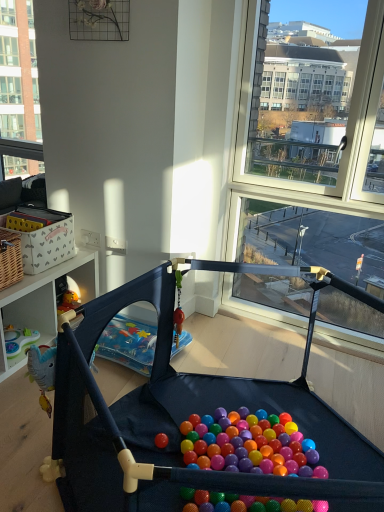
Question: Is matte black playpen at center facing away from clear glass window at upper left?

Choices:
 (A) no
 (B) yes

Answer: (A)

Question: From the image's perspective, would you say matte black playpen at center is positioned over clear glass window at upper left?

Choices:
 (A) no
 (B) yes

Answer: (A)

Question: From a real-world perspective, is matte black playpen at center below clear glass window at upper left?

Choices:
 (A) no
 (B) yes

Answer: (B)

Question: Is matte black playpen at center smaller than clear glass window at upper left?

Choices:
 (A) no
 (B) yes

Answer: (A)

Question: From a real-world perspective, is matte black playpen at center positioned over clear glass window at upper left based on gravity?

Choices:
 (A) yes
 (B) no

Answer: (B)

Question: Is the position of matte black playpen at center more distant than that of clear glass window at upper left?

Choices:
 (A) no
 (B) yes

Answer: (A)

Question: Does clear glass window at upper left lie behind matte black playpen at center?

Choices:
 (A) no
 (B) yes

Answer: (B)

Question: Is clear glass window at upper left aimed at matte black playpen at center?

Choices:
 (A) no
 (B) yes

Answer: (A)

Question: Considering the relative sizes of clear glass window at upper left and matte black playpen at center in the image provided, is clear glass window at upper left wider than matte black playpen at center?

Choices:
 (A) yes
 (B) no

Answer: (B)

Question: From a real-world perspective, is clear glass window at upper left beneath matte black playpen at center?

Choices:
 (A) no
 (B) yes

Answer: (A)

Question: Does clear glass window at upper left have a larger size compared to matte black playpen at center?

Choices:
 (A) no
 (B) yes

Answer: (A)

Question: From the image's perspective, would you say clear glass window at upper left is shown under matte black playpen at center?

Choices:
 (A) no
 (B) yes

Answer: (A)

Question: Is clear glass window at upper left wider or thinner than matte black playpen at center?

Choices:
 (A) thin
 (B) wide

Answer: (A)